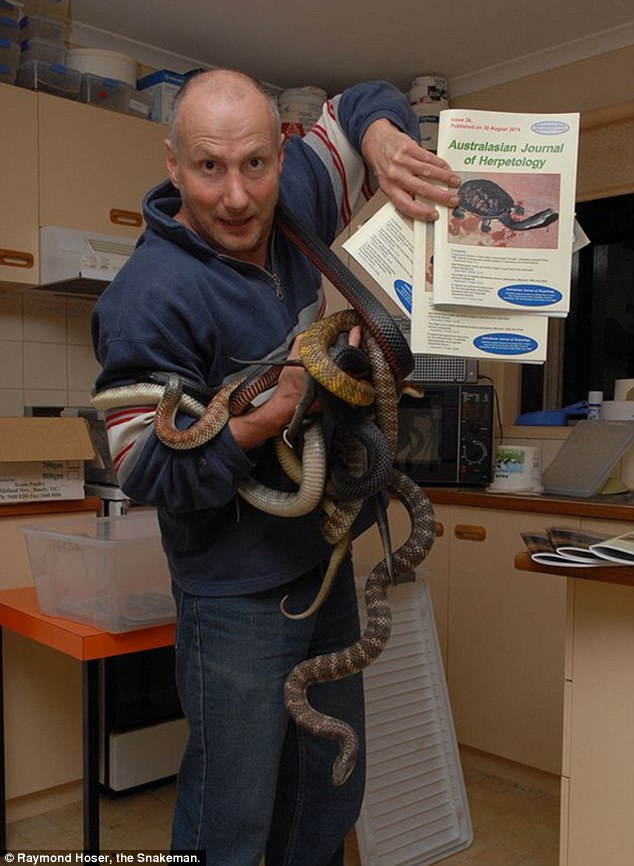
Locate an element on the screen. booklets is located at coordinates (617, 546), (570, 545), (541, 545), (444, 242), (437, 328), (394, 233).